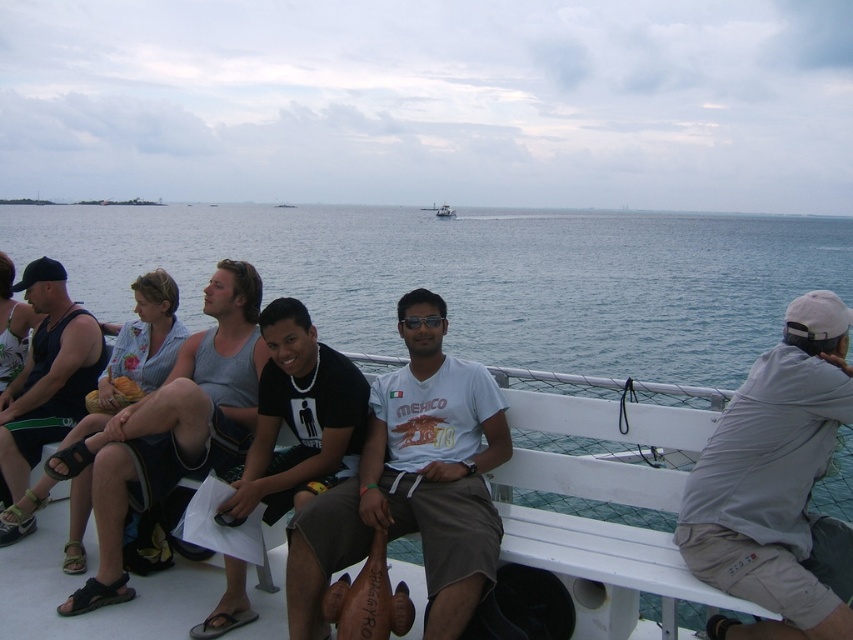
Question: Among these points, which one is farthest from the camera?

Choices:
 (A) (447, 212)
 (B) (141, 422)
 (C) (383, 408)
 (D) (3, 465)

Answer: (A)

Question: Where is white cotton shirt at center located in relation to matte black tank top at left in the image?

Choices:
 (A) above
 (B) below

Answer: (B)

Question: Which point appears closest to the camera in this image?

Choices:
 (A) [x=204, y=362]
 (B) [x=73, y=422]
 (C) [x=763, y=371]

Answer: (C)

Question: Does blue water at center appear on the right side of black matte t-shirt at center?

Choices:
 (A) yes
 (B) no

Answer: (B)

Question: Among these points, which one is farthest from the camera?

Choices:
 (A) (386, 433)
 (B) (245, 621)
 (C) (456, 211)
 (D) (102, 227)

Answer: (C)

Question: Considering the relative positions of white cotton shirt at center and matte black tank top at left in the image provided, where is white cotton shirt at center located with respect to matte black tank top at left?

Choices:
 (A) above
 (B) below

Answer: (B)